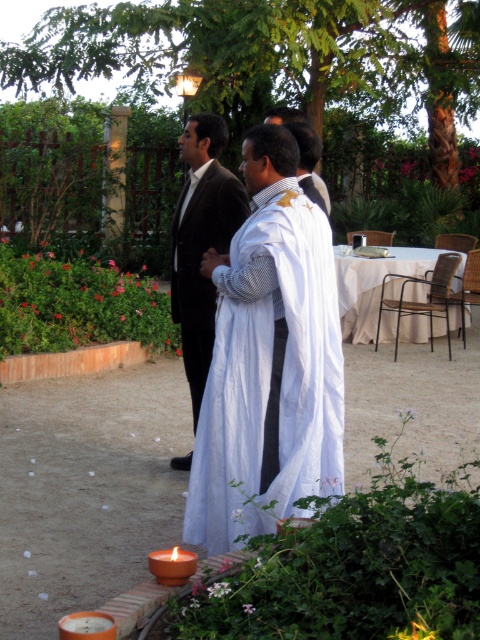
Question: In this image, where is white cotton robe at center located relative to matte orange candle at lower left?

Choices:
 (A) below
 (B) above

Answer: (B)

Question: Which of these objects is positioned farthest from the white cotton dress at center?

Choices:
 (A) matte brown candle at lower left
 (B) matte orange candle at lower left
 (C) white cotton robe at center

Answer: (B)

Question: Is matte brown candle at lower left bigger than matte orange candle at lower left?

Choices:
 (A) yes
 (B) no

Answer: (A)

Question: Among these objects, which one is farthest from the camera?

Choices:
 (A) white cotton robe at center
 (B) white cotton dress at center

Answer: (A)

Question: Does white cotton dress at center have a smaller size compared to matte orange candle at lower left?

Choices:
 (A) no
 (B) yes

Answer: (A)

Question: Which point is closer to the camera?

Choices:
 (A) white cotton robe at center
 (B) matte orange candle at lower left
 (C) matte brown candle at lower left
 (D) white cotton dress at center

Answer: (B)